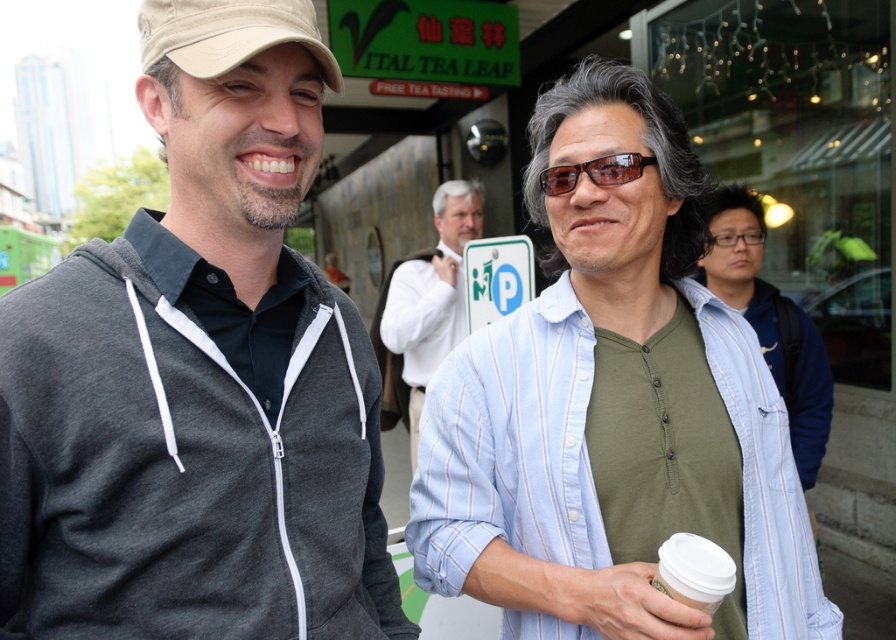
Question: In this image, where is dark gray zip-up hoodie at left located relative to white paper cup at center?

Choices:
 (A) below
 (B) above

Answer: (B)

Question: Among these objects, which one is nearest to the camera?

Choices:
 (A) white shirt at center
 (B) light blue striped shirt at center
 (C) dark gray zip-up hoodie at left

Answer: (C)

Question: Considering the relative positions of white shirt at center and white paper cup at center in the image provided, where is white shirt at center located with respect to white paper cup at center?

Choices:
 (A) left
 (B) right

Answer: (A)

Question: Which point appears closest to the camera in this image?

Choices:
 (A) (762, 285)
 (B) (154, 452)

Answer: (B)

Question: Can you confirm if light blue striped shirt at center is positioned below white paper cup at center?

Choices:
 (A) yes
 (B) no

Answer: (B)

Question: Which point appears farthest from the camera in this image?

Choices:
 (A) (451, 188)
 (B) (691, 598)
 (C) (264, 189)

Answer: (A)